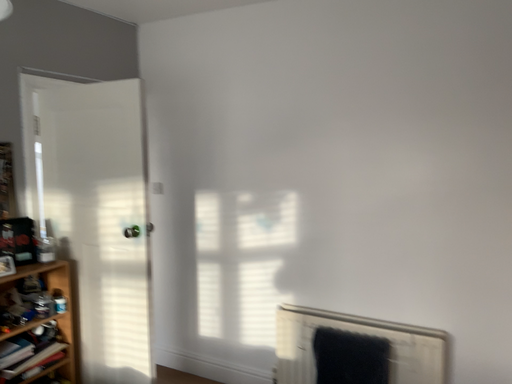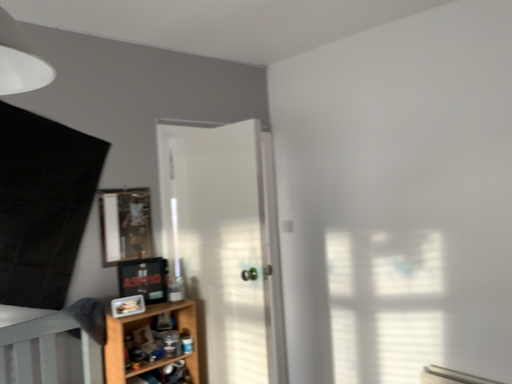
Question: Which way did the camera rotate in the video?

Choices:
 (A) rotated right
 (B) rotated left

Answer: (B)